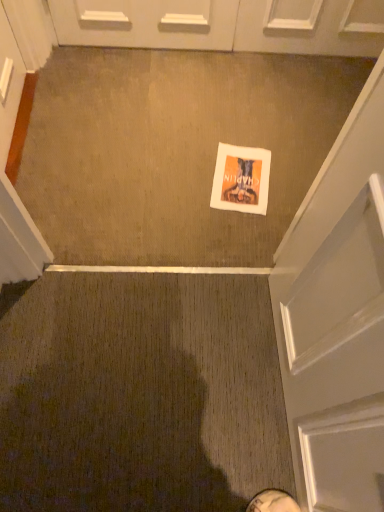
Question: Is white glossy door at upper center spatially inside white leather shoe at lower center, or outside of it?

Choices:
 (A) inside
 (B) outside

Answer: (B)

Question: In terms of height, does white glossy door at upper center look taller or shorter compared to white leather shoe at lower center?

Choices:
 (A) tall
 (B) short

Answer: (A)

Question: Which object is positioned closest to the white paper flyer at center?

Choices:
 (A) white leather shoe at lower center
 (B) white glossy door at upper center

Answer: (B)

Question: Which object is the closest to the white leather shoe at lower center?

Choices:
 (A) white glossy door at upper center
 (B) white paper flyer at center

Answer: (B)